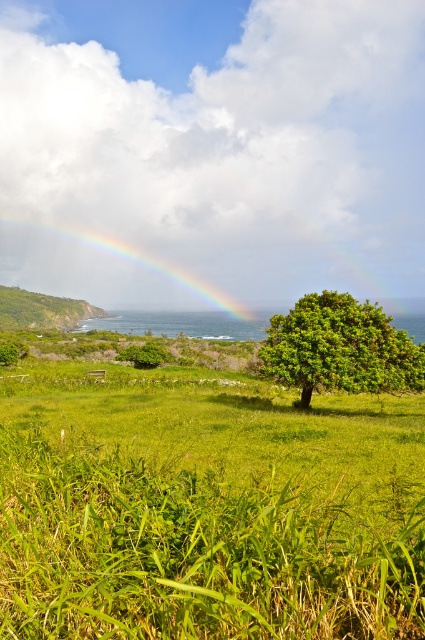
You are a hiker who wants to take a photo of the green leafy tree at center and the green grassy hillside at left. Which one should you get closer to in order to capture both in the same frame?

To capture both the green leafy tree at center and the green grassy hillside at left in the same frame, you should get closer to the green leafy tree at center because it is shorter than the green grassy hillside at left, allowing you to include both within the camera view.

You are an artist planning to paint this coastal landscape. You want to ensure the rainbow at center and the green grassy hillside at left are proportionally accurate. Which object should you make wider in your painting?

The rainbow at center should be made wider in the painting since its width is larger than the green grassy hillside at left according to the description.

You are a photographer planning to capture the rainbow at center and the green grassy hillside at left in a single shot. Which object will appear larger in the photo?

The rainbow at center will appear larger in the photo because it is much taller than the green grassy hillside at left.